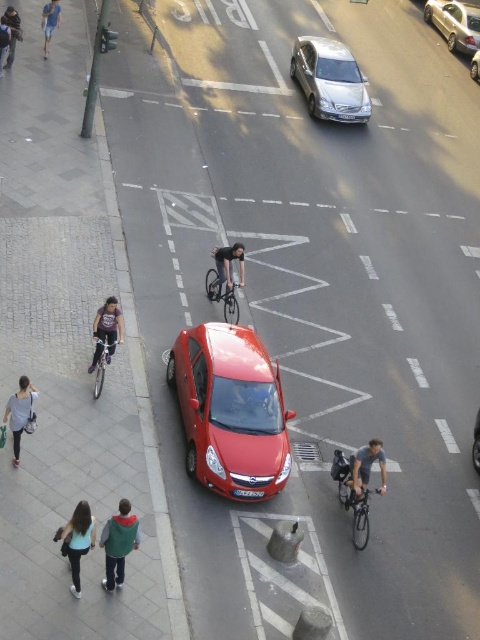
You are a delivery person on a bicycle trying to navigate through the street. You see a denim jacket at left and a shiny red car at center. Which object is closer to your left side?

The denim jacket at left is positioned on the left side of the shiny red car at center, so it is closer to your left side.

You are a delivery drone operator. Your drone has a wingspan of 1.2 meters and needs to fly between the denim jacket at left and the shiny red car at center. Based on the spatial relationship between these two objects, can the drone safely pass through this gap?

The denim jacket at left might be wider than the shiny red car at center, but without exact measurements, it is uncertain if the gap between them is sufficient for the drone with a 1.2 meter wingspan. Proceed with caution or seek more precise spatial data.